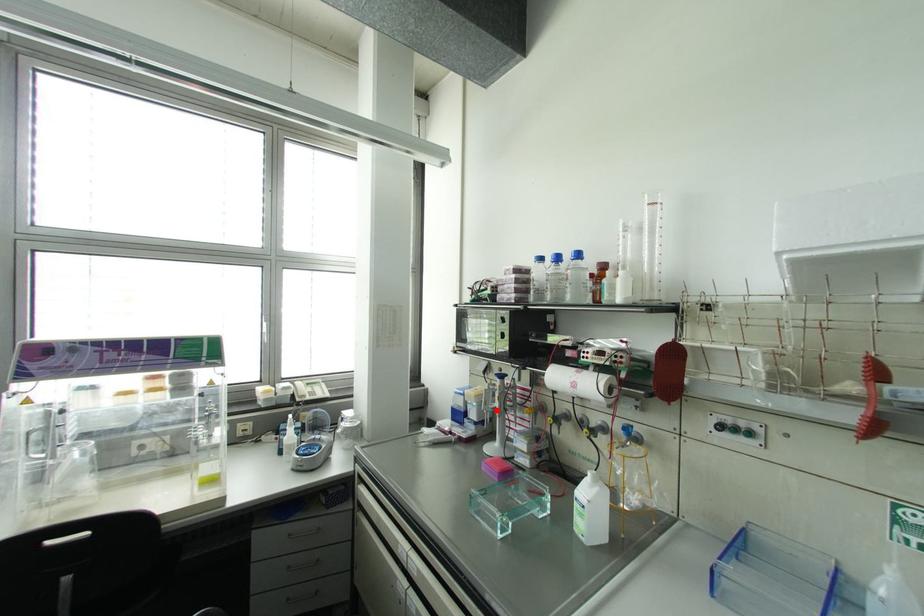
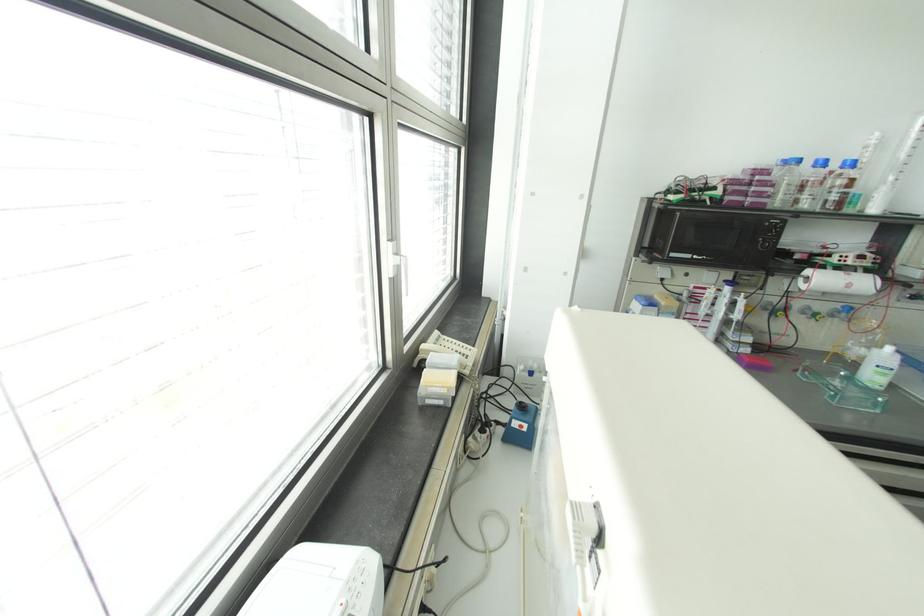
Find the pixel in the second image that matches the highlighted location in the first image.

(736, 315)